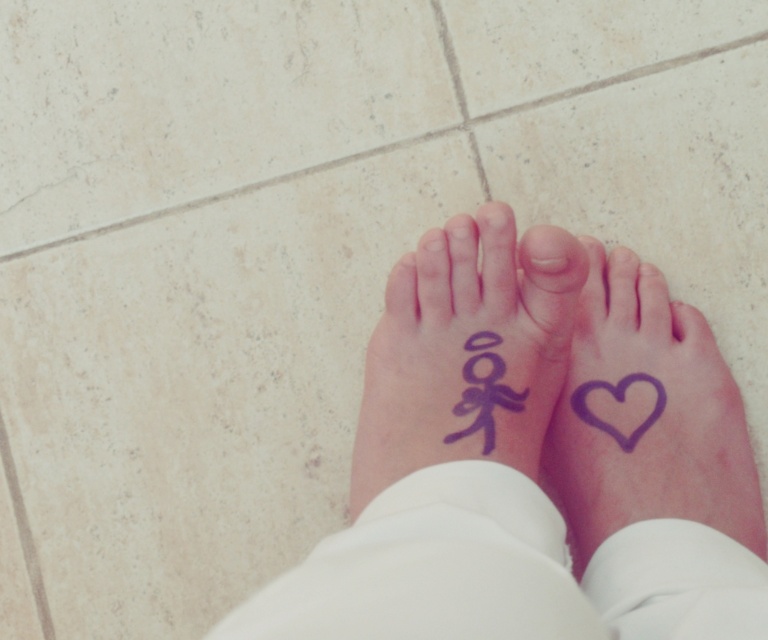
Is the position of purple matte stick figure at center less distant than that of purple matte heart at center?

Yes, it is.

Is purple matte stick figure at center smaller than purple matte heart at center?

Incorrect, purple matte stick figure at center is not smaller in size than purple matte heart at center.

Identify the location of purple matte stick figure at center. The height and width of the screenshot is (640, 768). pos(467,349).

Which is below, purple matte heart at lower center or matte skin at center?

purple matte heart at lower center

Does purple matte heart at lower center appear on the right side of matte skin at center?

In fact, purple matte heart at lower center is to the left of matte skin at center.

At what (x,y) coordinates should I click in order to perform the action: click on purple matte heart at lower center. Please return your answer as a coordinate pair (x, y). This screenshot has width=768, height=640. Looking at the image, I should click on (531, 465).

Is white smooth fabric at lower center behind matte skin at center?

No, it is in front of matte skin at center.

From the picture: Can you confirm if white smooth fabric at lower center is bigger than matte skin at center?

Indeed, white smooth fabric at lower center has a larger size compared to matte skin at center.

Is point (421, 502) positioned in front of point (568, 272)?

Yes.

I want to click on white smooth fabric at lower center, so click(480, 500).